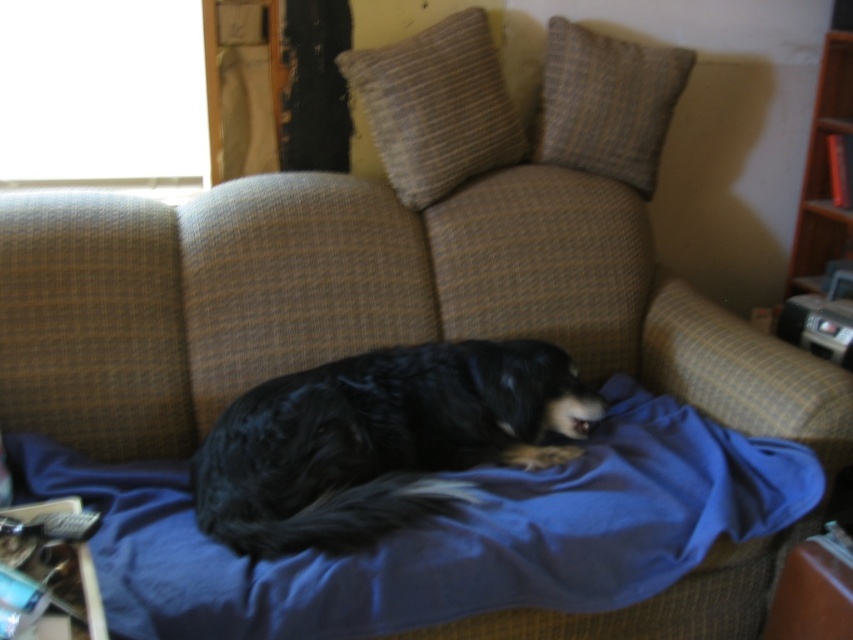
You are trying to decide whether to place a small decorative item on the textured beige pillow at upper right or on the wooden bookshelf at right. Which surface can accommodate a taller item without it falling over?

The wooden bookshelf at right is taller than the textured beige pillow at upper right, so it can accommodate a taller item without it falling over.

You are an interior designer assessing the layout of this living room. You notice the textured beige pillow at upper center and the wooden bookshelf at right. Based on their positions, which object is closer to the viewer?

The textured beige pillow at upper center is closer to the viewer because it is positioned over the wooden bookshelf at right, indicating it is in front of it.

You are standing in the room and want to place a small toy for the black fur dog at center. According to the image, where should you place the toy relative to the dog?

The black fur dog at center is located at point 0.689 on the x axis and 0.447 on the y axis. To place the toy near the dog, position it close to those coordinates.